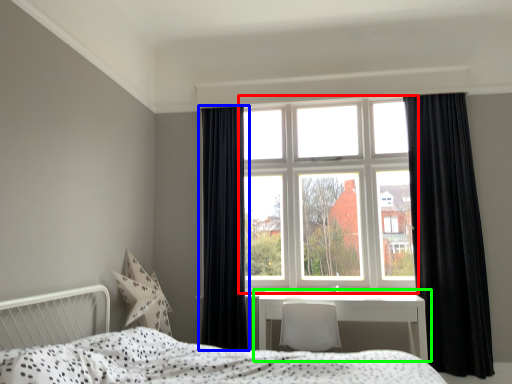
Question: Which object is positioned farthest from window (highlighted by a red box)? Select from curtain (highlighted by a blue box) and table (highlighted by a green box).

Choices:
 (A) curtain
 (B) table

Answer: (B)